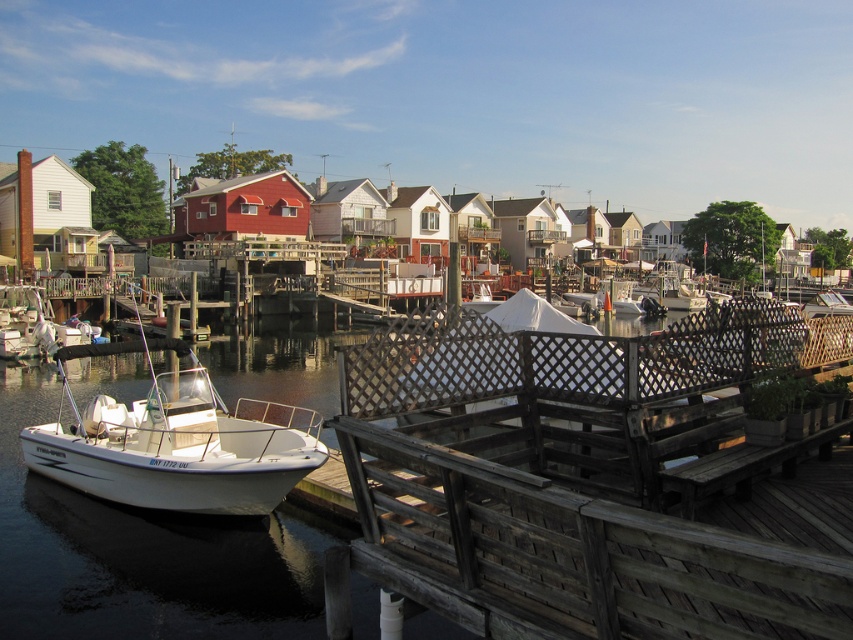
Who is shorter, wooden dock at center or white matte boat at lower left?

With less height is wooden dock at center.

Who is more forward, (643,522) or (181,349)?

Point (643,522) is in front.

Image resolution: width=853 pixels, height=640 pixels. What do you see at coordinates (572, 476) in the screenshot? I see `wooden dock at center` at bounding box center [572, 476].

Where is `wooden dock at center`? Image resolution: width=853 pixels, height=640 pixels. wooden dock at center is located at coordinates [572, 476].